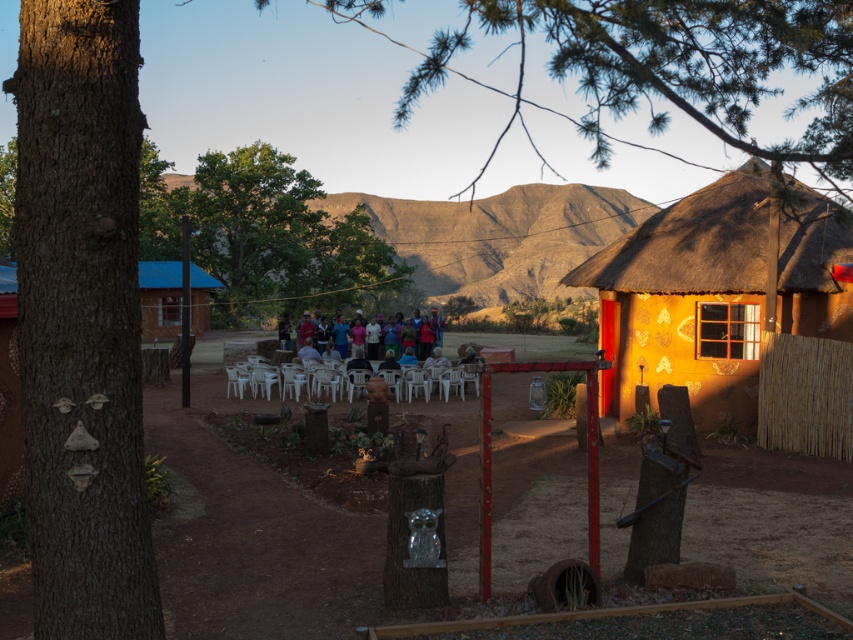
You are organizing a picnic and want to place a picnic basket between the rugged brown mountain at center and the multicolored fabric group at center. Which side of the picnic basket should face the wider object?

The rugged brown mountain at center is wider than the multicolored fabric group at center, so the picnic basket should face the rugged brown mountain at center side.

You are standing in the middle of the dirt ground area and want to take a photo of the rugged brown mountain at center and the multicolored fabric group at center. Which object should you position to your left side to capture both in the frame?

You should position the rugged brown mountain at center to your left side because it is already to the left of the multicolored fabric group at center, allowing both to be captured in the frame.